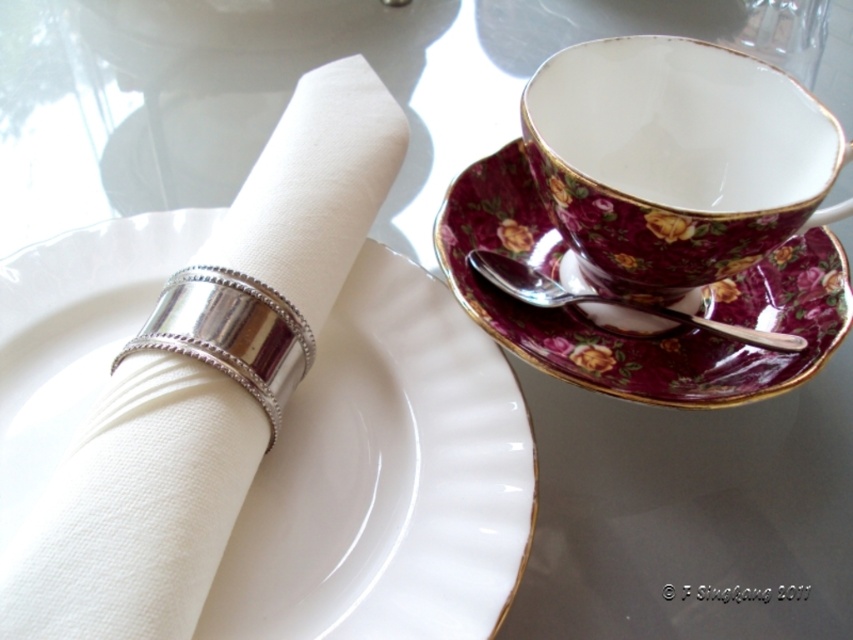
Question: Does white porcelain plate at center appear over maroon floral porcelain saucer at upper right?

Choices:
 (A) yes
 (B) no

Answer: (B)

Question: Does white porcelain plate at center appear under silver metallic spoon at upper right?

Choices:
 (A) yes
 (B) no

Answer: (A)

Question: Which of the following is the farthest from the observer?

Choices:
 (A) silver metallic spoon at upper right
 (B) porcelain floral teacup at upper right
 (C) white porcelain plate at center

Answer: (A)

Question: Which point appears closest to the camera in this image?

Choices:
 (A) (675, 86)
 (B) (450, 204)

Answer: (A)

Question: Does white porcelain plate at center appear on the right side of porcelain floral teacup at upper right?

Choices:
 (A) yes
 (B) no

Answer: (B)

Question: Which of the following is the closest to the observer?

Choices:
 (A) (799, 163)
 (B) (560, 292)
 (C) (469, 429)

Answer: (C)